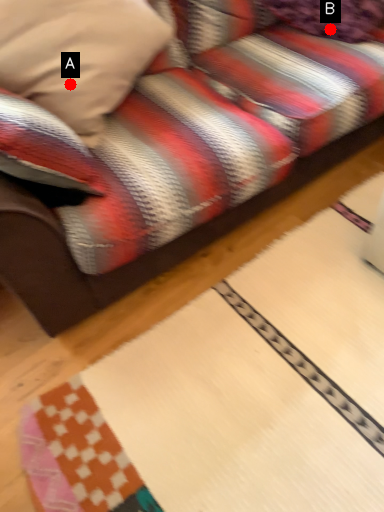
Question: Two points are circled on the image, labeled by A and B beside each circle. Which point is farther to the camera?

Choices:
 (A) A is further
 (B) B is further

Answer: (B)